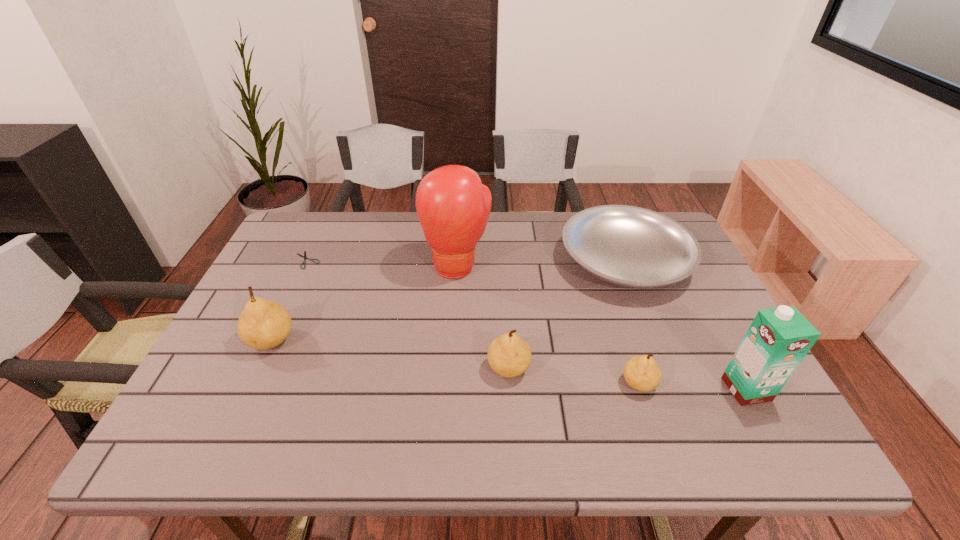
Where is `the third tallest object`? This screenshot has width=960, height=540. the third tallest object is located at coordinates [x=263, y=324].

Where is `the leftmost pear`? Image resolution: width=960 pixels, height=540 pixels. the leftmost pear is located at coordinates (263, 324).

The height and width of the screenshot is (540, 960). Find the location of `the fourth tallest object`. the fourth tallest object is located at coordinates (508, 355).

Find the location of a particular element. The height and width of the screenshot is (540, 960). the second pear from left to right is located at coordinates (508, 355).

Find the location of a particular element. This screenshot has height=540, width=960. the rightmost pear is located at coordinates (642, 373).

This screenshot has height=540, width=960. In order to click on the shortest pear in this screenshot , I will do click(642, 373).

Locate an element on the screen. This screenshot has height=540, width=960. bedpan is located at coordinates (629, 246).

This screenshot has width=960, height=540. Find the location of `the tallest object`. the tallest object is located at coordinates (453, 206).

This screenshot has width=960, height=540. Identify the location of the shortest object. (304, 256).

Locate an element on the screen. The width and height of the screenshot is (960, 540). the second tallest object is located at coordinates (778, 339).